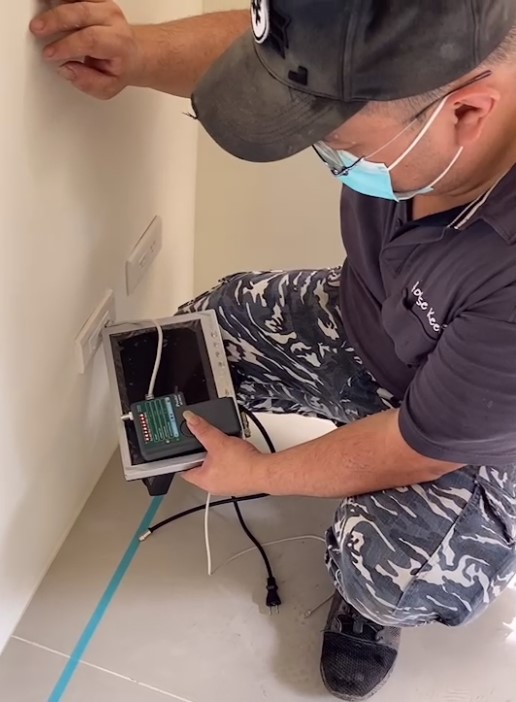
This screenshot has height=702, width=516. I want to click on wall outlets, so (92, 343), (134, 271).